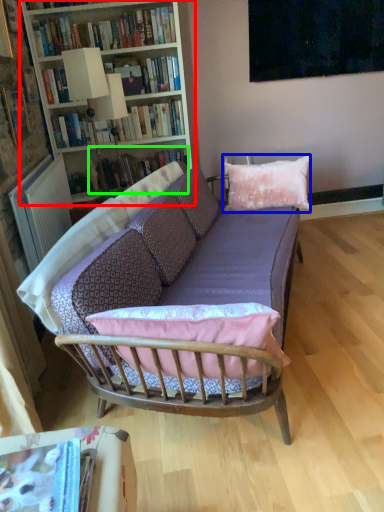
Question: Considering the real-world distances, which object is farthest from bookcase (highlighted by a red box)? pillow (highlighted by a blue box) or book (highlighted by a green box)?

Choices:
 (A) pillow
 (B) book

Answer: (A)